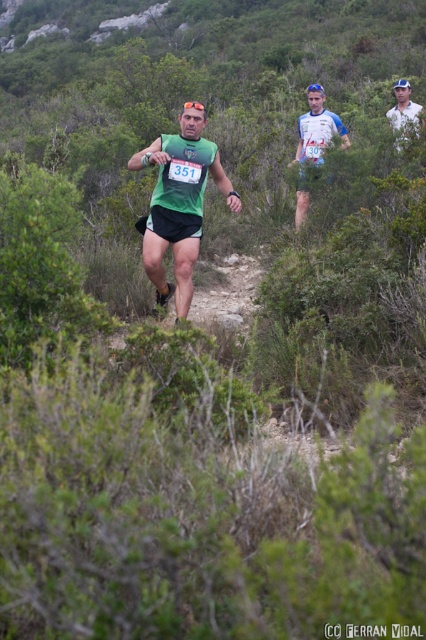
You are a photographer positioned at the starting line of the trail running event. You have a camera in your hand and want to capture a close shot of the green matte running vest at center. Given that the camera has a minimum focusing distance of 4 meters, will you be able to take a clear photo of the vest?

The green matte running vest at center and camera are 5.06 meters apart. Since the minimum focusing distance is 4 meters, the photographer can take a clear photo as the distance is sufficient.

You are a trail runner preparing to start a race. You see the point marked at coordinates (313, 144). What is the color of the clothing item located at that point?

The point at coordinates (313, 144) indicates a matte green tank top at center, so the clothing item there is green.

You are a race official at the trail running event. You need to determine the current position of the two runners based on their visibility in the image. Which runner is closer to the starting line, the green matte running vest at center or the white cotton shirt at upper right?

The green matte running vest at center is closer to the starting line because it is positioned in front of the white cotton shirt at upper right in the image.